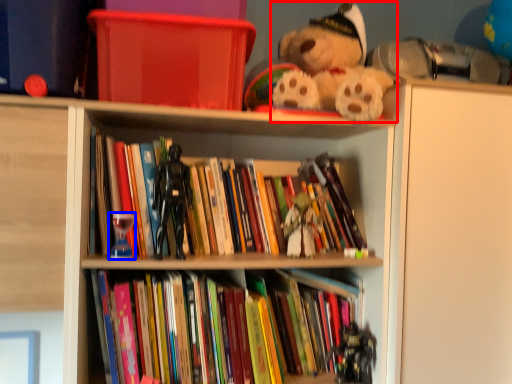
Question: Which of the following is the farthest to the observer, teddy bear (highlighted by a red box) or toy (highlighted by a blue box)?

Choices:
 (A) teddy bear
 (B) toy

Answer: (B)